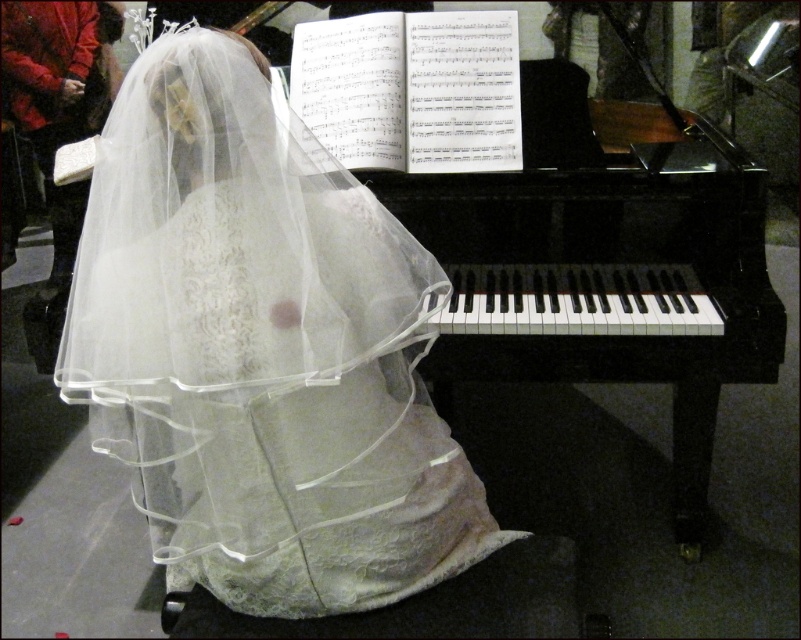
Question: In this image, where is white lace dress at center located relative to black polished piano at center?

Choices:
 (A) above
 (B) below

Answer: (B)

Question: Does white lace dress at center appear on the left side of black polished piano at center?

Choices:
 (A) no
 (B) yes

Answer: (B)

Question: Which point appears farthest from the camera in this image?

Choices:
 (A) (715, 260)
 (B) (415, 307)

Answer: (A)

Question: Is white lace dress at center positioned behind black polished piano at center?

Choices:
 (A) no
 (B) yes

Answer: (A)